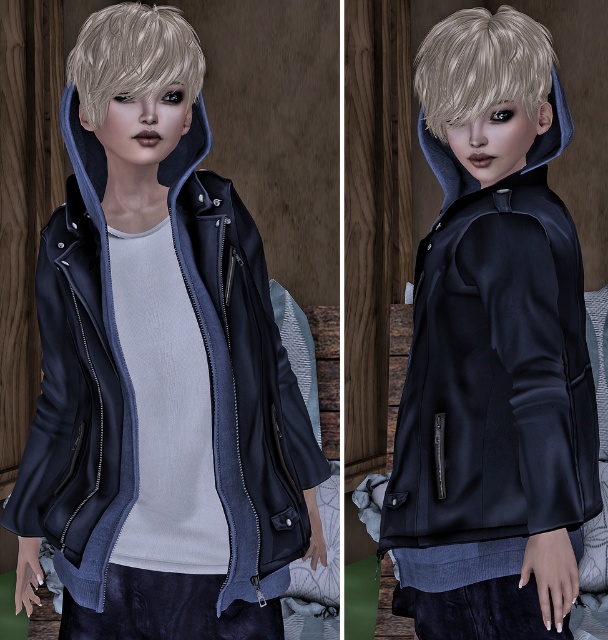
Question: Where is satin black jacket at center located in relation to blondehair at upper center in the image?

Choices:
 (A) right
 (B) left

Answer: (B)

Question: Can you confirm if satin black jacket at center is thinner than blondehair at center?

Choices:
 (A) no
 (B) yes

Answer: (A)

Question: Which point appears farthest from the camera in this image?

Choices:
 (A) (489, 104)
 (B) (280, 520)

Answer: (A)

Question: Considering the real-world distances, which object is farthest from the matte black jacket at center?

Choices:
 (A) matte blue hood at upper center
 (B) satin black jacket at center
 (C) blondehair at center

Answer: (A)

Question: Which of the following is the closest to the observer?

Choices:
 (A) blondehair at upper center
 (B) matte blue hood at upper center
 (C) satin black jacket at center

Answer: (C)

Question: Where is satin black jacket at center located in relation to blondehair at upper center in the image?

Choices:
 (A) left
 (B) right

Answer: (A)